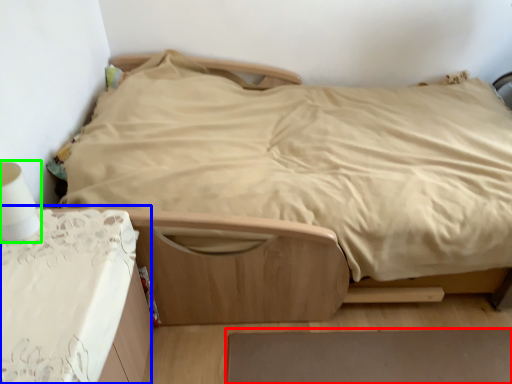
Question: Which object is the farthest from plain (highlighted by a red box)? Choose among these: table (highlighted by a blue box) or table lamp (highlighted by a green box).

Choices:
 (A) table
 (B) table lamp

Answer: (B)